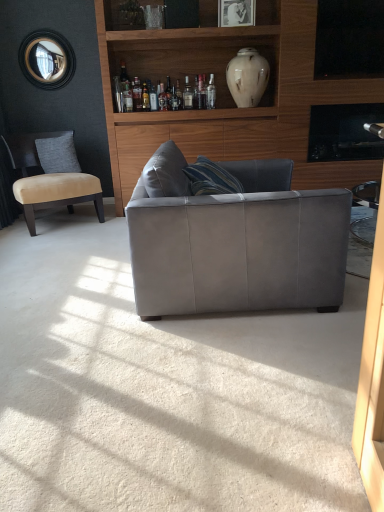
Question: Considering the relative sizes of white marble vase at upper center and matte white vase at upper center in the image provided, is white marble vase at upper center wider than matte white vase at upper center?

Choices:
 (A) yes
 (B) no

Answer: (B)

Question: Are white marble vase at upper center and matte white vase at upper center far apart?

Choices:
 (A) yes
 (B) no

Answer: (B)

Question: Does white marble vase at upper center contain matte white vase at upper center?

Choices:
 (A) yes
 (B) no

Answer: (B)

Question: Does white marble vase at upper center have a lesser width compared to matte white vase at upper center?

Choices:
 (A) yes
 (B) no

Answer: (A)

Question: Can you confirm if white marble vase at upper center is shorter than matte white vase at upper center?

Choices:
 (A) yes
 (B) no

Answer: (A)

Question: Is the depth of white marble vase at upper center less than that of matte white vase at upper center?

Choices:
 (A) no
 (B) yes

Answer: (A)

Question: Is translucent glass bottle at upper center, which appears as the third bottle when viewed from the left, thinner than suede gray couch at center?

Choices:
 (A) no
 (B) yes

Answer: (B)

Question: Is translucent glass bottle at upper center, which appears as the third bottle when viewed from the left, bigger than suede gray couch at center?

Choices:
 (A) no
 (B) yes

Answer: (A)

Question: Is the position of translucent glass bottle at upper center, positioned as the 1th bottle in right-to-left order, less distant than that of suede gray couch at center?

Choices:
 (A) no
 (B) yes

Answer: (A)

Question: Is translucent glass bottle at upper center, which appears as the third bottle when viewed from the left, not close to suede gray couch at center?

Choices:
 (A) yes
 (B) no

Answer: (A)

Question: Is translucent glass bottle at upper center, positioned as the 1th bottle in right-to-left order, not inside suede gray couch at center?

Choices:
 (A) no
 (B) yes

Answer: (B)

Question: Considering the relative positions of translucent glass bottle at upper center, which appears as the third bottle when viewed from the left, and suede gray couch at center in the image provided, is translucent glass bottle at upper center, which appears as the third bottle when viewed from the left, to the right of suede gray couch at center from the viewer's perspective?

Choices:
 (A) yes
 (B) no

Answer: (B)

Question: Does gray fabric pillow at left have a lesser height compared to beige fabric chair at left?

Choices:
 (A) no
 (B) yes

Answer: (B)